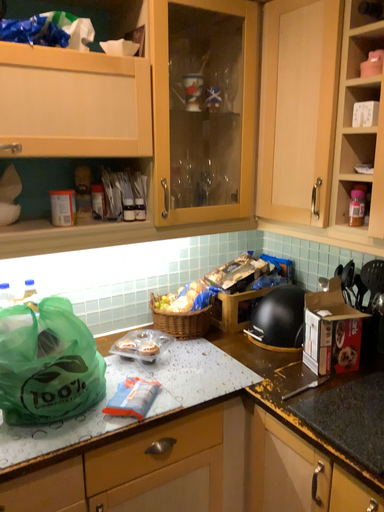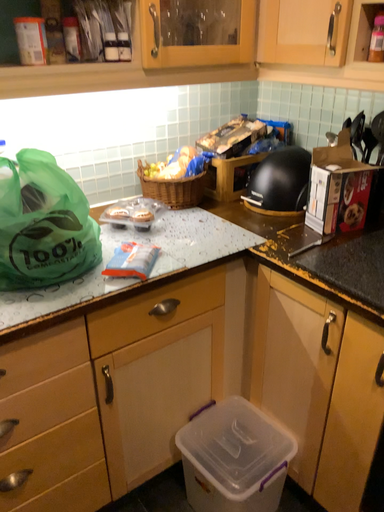
Question: Which way did the camera rotate in the video?

Choices:
 (A) rotated upward
 (B) rotated downward

Answer: (B)